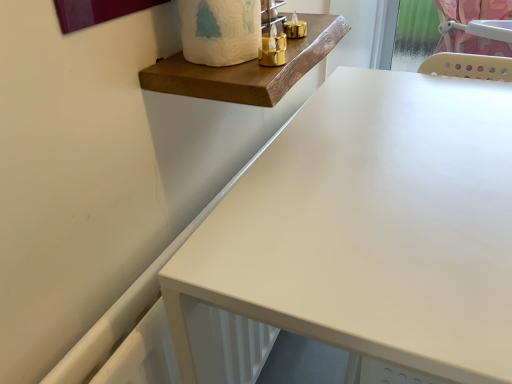
What are the coordinates of `white matte toilet paper at upper center` in the screenshot? It's located at (220, 31).

Identify the location of wooden plank at upper center. Image resolution: width=512 pixels, height=384 pixels. (248, 69).

In the image, there is a white matte toilet paper at upper center. Where is `changing table below it (from the image's perspective)`? The width and height of the screenshot is (512, 384). changing table below it (from the image's perspective) is located at coordinates (248, 69).

Looking at this image, could you tell me if wooden plank at upper center is turned towards white matte toilet paper at upper center?

No, wooden plank at upper center is not aimed at white matte toilet paper at upper center.

Does wooden plank at upper center touch white matte toilet paper at upper center?

Yes, wooden plank at upper center is next to white matte toilet paper at upper center.

How much distance is there between wooden plank at upper center and white matte toilet paper at upper center?

wooden plank at upper center and white matte toilet paper at upper center are 3.69 inches apart.

The image size is (512, 384). Find the location of `changing table below the white matte toilet paper at upper center (from the image's perspective)`. changing table below the white matte toilet paper at upper center (from the image's perspective) is located at coordinates (248, 69).

Looking at this image, in terms of height, does white matte toilet paper at upper center look taller or shorter compared to wooden plank at upper center?

white matte toilet paper at upper center is taller than wooden plank at upper center.

In the scene shown: Can you tell me how much white matte toilet paper at upper center and wooden plank at upper center differ in facing direction?

0.516 degrees separate the facing orientations of white matte toilet paper at upper center and wooden plank at upper center.

From the image's perspective, who appears lower, white matte toilet paper at upper center or wooden plank at upper center?

wooden plank at upper center appears lower in the image.

Consider the image. From a real-world perspective, which is physically below, matte white table at center or white matte toilet paper at upper center?

From a 3D spatial view, matte white table at center is below.

Would you consider matte white table at center to be distant from white matte toilet paper at upper center?

No, matte white table at center is in close proximity to white matte toilet paper at upper center.

Is matte white table at center wider than white matte toilet paper at upper center?

Yes.

Where is `table below the white matte toilet paper at upper center (from a real-world perspective)`? The height and width of the screenshot is (384, 512). table below the white matte toilet paper at upper center (from a real-world perspective) is located at coordinates (370, 229).

How different are the orientations of wooden plank at upper center and matte white table at center in degrees?

The angular difference between wooden plank at upper center and matte white table at center is 89.5 degrees.

In terms of height, does wooden plank at upper center look taller or shorter compared to matte white table at center?

In the image, wooden plank at upper center appears to be shorter than matte white table at center.

Which point is more distant from viewer, (335, 26) or (389, 169)?

Positioned behind is point (335, 26).

Is white matte toilet paper at upper center bigger than matte white table at center?

No.

Based on their positions, is white matte toilet paper at upper center located to the left or right of matte white table at center?

In the image, white matte toilet paper at upper center appears on the left side of matte white table at center.

Between point (249, 33) and point (490, 192), which one is positioned in front?

Positioned in front is point (490, 192).

Is white matte toilet paper at upper center not inside matte white table at center?

white matte toilet paper at upper center lies outside matte white table at center's area.

Between point (388, 135) and point (236, 98), which one is positioned in front?

Point (236, 98)

Who is more distant, matte white table at center or wooden plank at upper center?

Positioned behind is wooden plank at upper center.

Can we say matte white table at center lies outside wooden plank at upper center?

Yes, matte white table at center is not within wooden plank at upper center.

How much distance is there between matte white table at center and wooden plank at upper center?

A distance of 7.30 inches exists between matte white table at center and wooden plank at upper center.

You are a GUI agent. You are given a task and a screenshot of the screen. Output one action in this format:
    pyautogui.click(x=<x>, y=<y>)
    Task: Click on the toilet paper in front of the wooden plank at upper center
    
    Given the screenshot: What is the action you would take?
    pyautogui.click(x=220, y=31)

Where is `changing table below the white matte toilet paper at upper center (from a real-world perspective)`? Image resolution: width=512 pixels, height=384 pixels. changing table below the white matte toilet paper at upper center (from a real-world perspective) is located at coordinates (248, 69).

Estimate the real-world distances between objects in this image. Which object is further from white matte toilet paper at upper center, wooden plank at upper center or matte white table at center?

Among the two, matte white table at center is located further to white matte toilet paper at upper center.

From the image, which object appears to be nearer to wooden plank at upper center, white matte toilet paper at upper center or matte white table at center?

white matte toilet paper at upper center is closer to wooden plank at upper center.

Looking at this image, when comparing their distances from wooden plank at upper center, does matte white table at center or white matte toilet paper at upper center seem closer?

white matte toilet paper at upper center.

Considering their positions, is wooden plank at upper center positioned closer to matte white table at center than white matte toilet paper at upper center?

wooden plank at upper center.

Based on their spatial positions, is white matte toilet paper at upper center or wooden plank at upper center closer to matte white table at center?

Among the two, wooden plank at upper center is located nearer to matte white table at center.

Estimate the real-world distances between objects in this image. Which object is further from white matte toilet paper at upper center, matte white table at center or wooden plank at upper center?

Based on the image, matte white table at center appears to be further to white matte toilet paper at upper center.

The image size is (512, 384). Find the location of `changing table between white matte toilet paper at upper center and matte white table at center from top to bottom`. changing table between white matte toilet paper at upper center and matte white table at center from top to bottom is located at coordinates (248, 69).